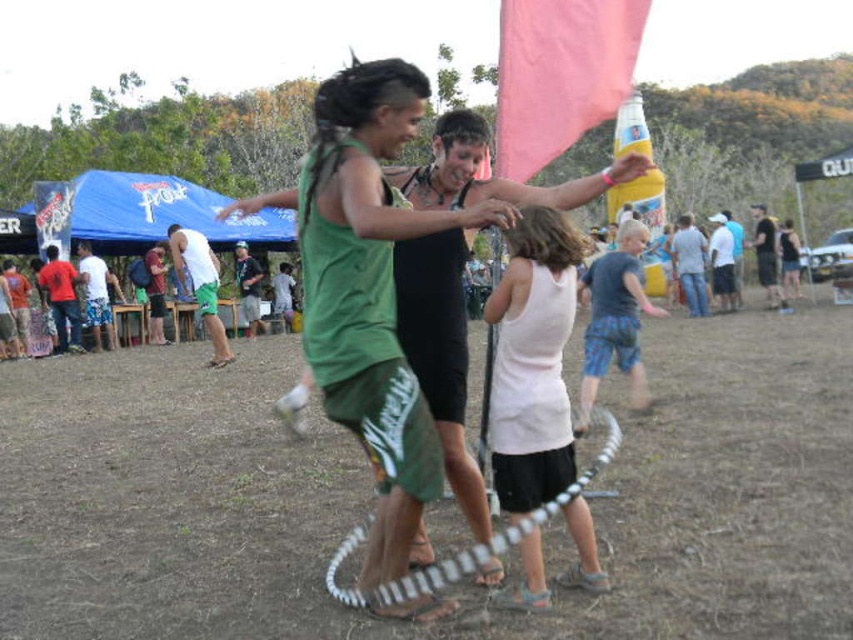
Question: Among these objects, which one is nearest to the camera?

Choices:
 (A) jeans at right
 (B) blue plaid shorts at center
 (C) matte red shirt at left

Answer: (B)

Question: Which point is farther to the camera?

Choices:
 (A) (573, 362)
 (B) (717, 296)
 (C) (410, 280)
 (D) (599, 305)

Answer: (B)

Question: Is white cotton tank top at center above white matte shorts at center?

Choices:
 (A) no
 (B) yes

Answer: (A)

Question: Can you confirm if blue plaid shorts at center is positioned to the right of light blue denim shorts at center?

Choices:
 (A) yes
 (B) no

Answer: (B)

Question: Which is nearer to the black matte shorts at center?

Choices:
 (A) blue plaid shorts at center
 (B) brown dirt field at center

Answer: (A)

Question: Does white cotton tank top at center appear over white matte shorts at center?

Choices:
 (A) yes
 (B) no

Answer: (B)